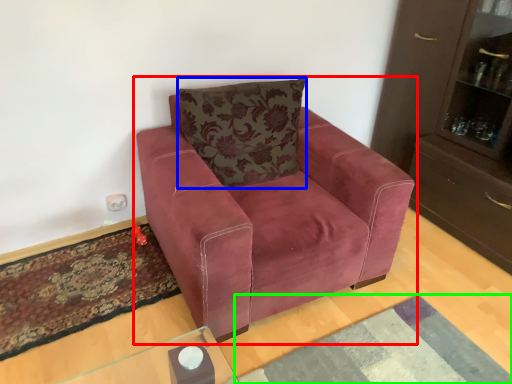
Question: Which is farther away from chair (highlighted by a red box)? pillow (highlighted by a blue box) or mat (highlighted by a green box)?

Choices:
 (A) pillow
 (B) mat

Answer: (B)